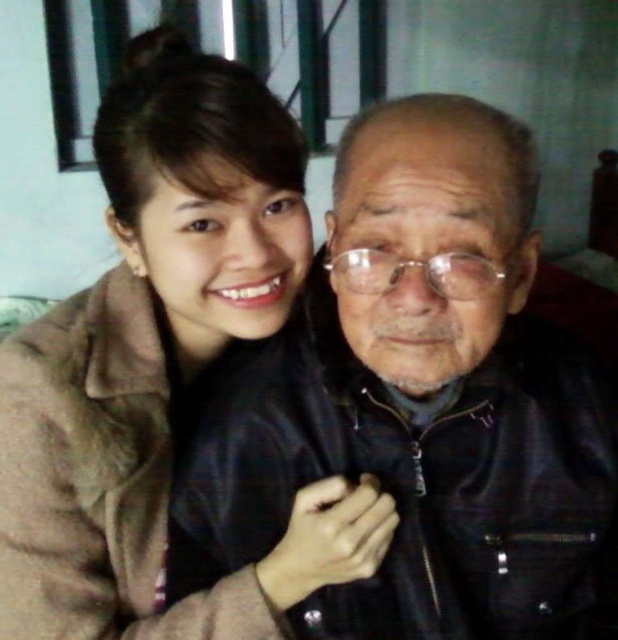
You are a fashion designer observing the image. You need to decide which garment is placed higher between the leather jacket at center and the brown fuzzy coat at upper left. Which one is higher?

The brown fuzzy coat at upper left is positioned higher than the leather jacket at center.

You are standing in front of a mirror that reflects the image shown. You want to pick up the leather jacket at center without moving your feet. Can you reach it?

The leather jacket at center is 18.95 inches away from the viewer, so yes, you can reach it without moving your feet.

You are trying to decide which coat to wear for a cold day. You see the leather jacket at center and the brown fuzzy coat at upper left in the image. Which one has a bigger size?

The leather jacket at center is larger in size than the brown fuzzy coat at upper left, so the leather jacket at center is bigger in size.